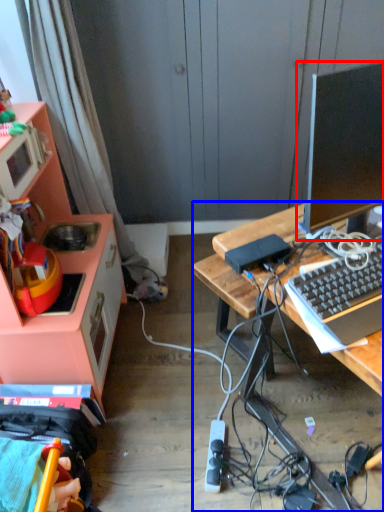
Question: Which object is further to the camera taking this photo, television (highlighted by a red box) or desk (highlighted by a blue box)?

Choices:
 (A) television
 (B) desk

Answer: (B)